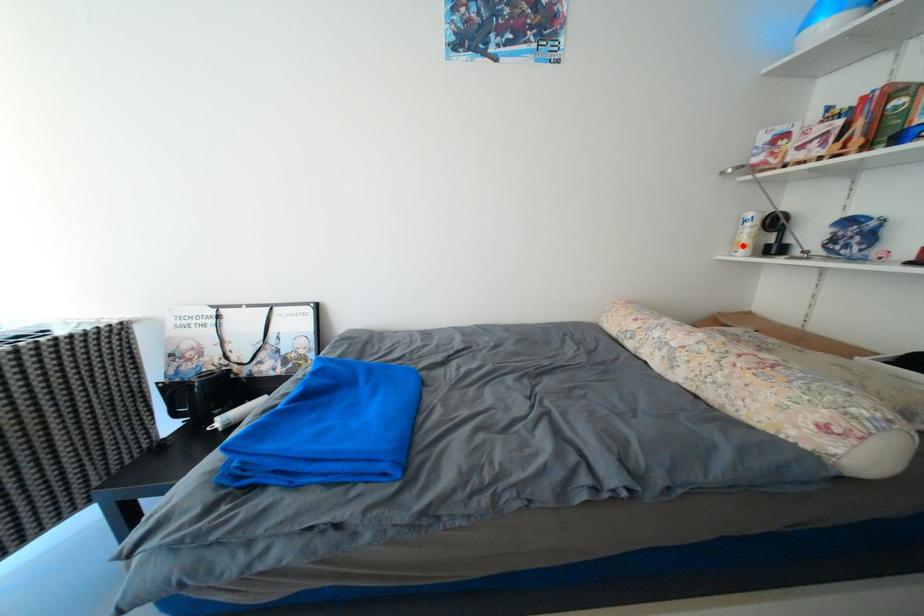
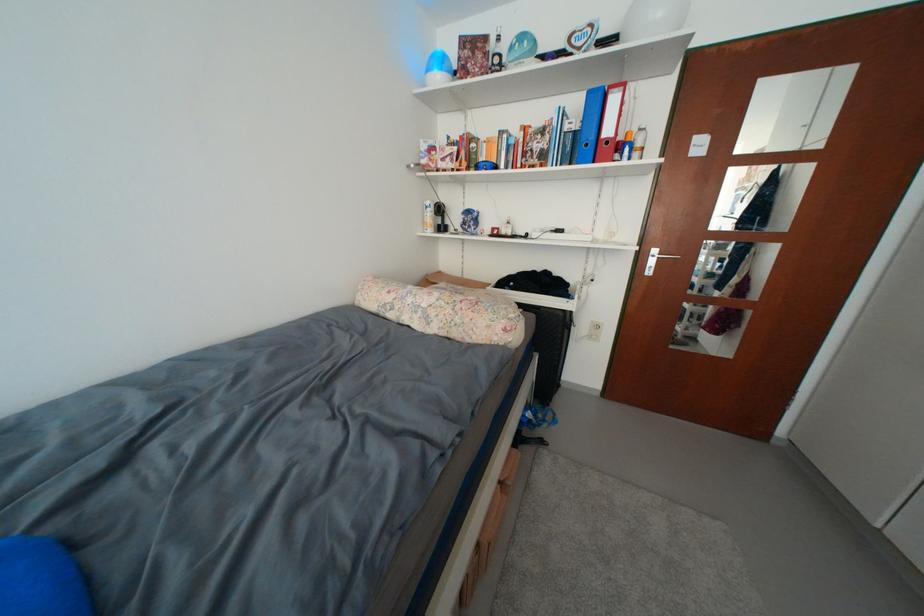
In the second image, find the point that corresponds to the highlighted location in the first image.

(432, 225)